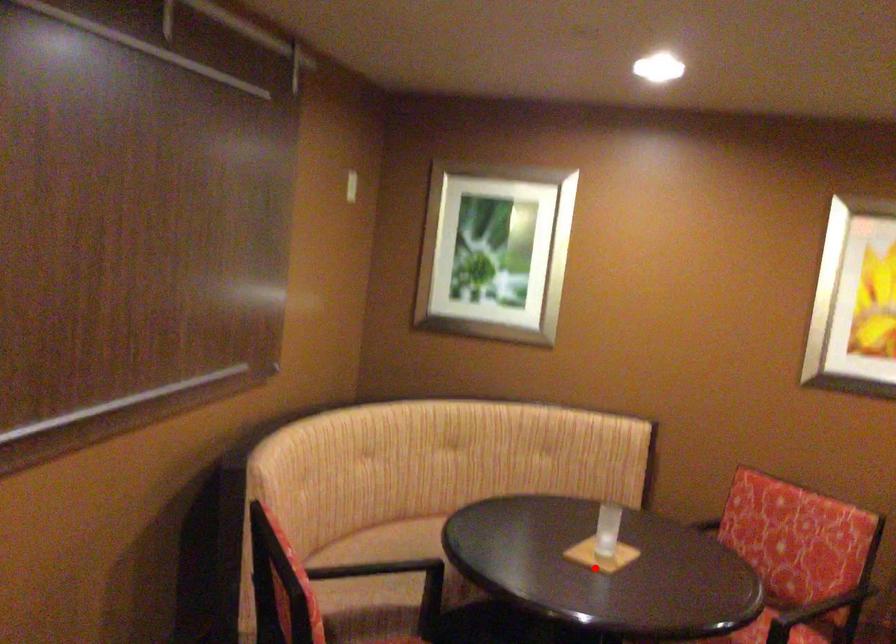
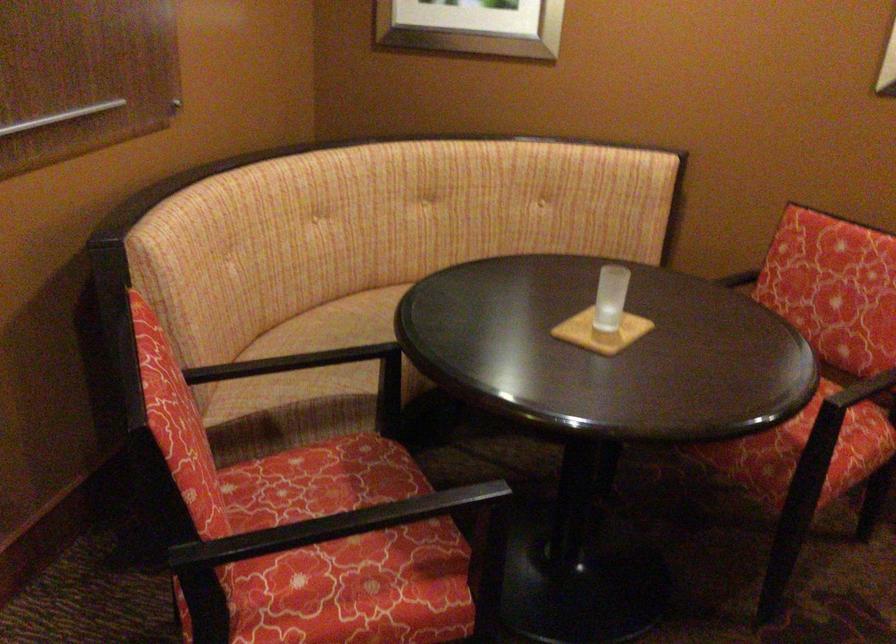
In the second image, find the point that corresponds to the highlighted location in the first image.

(600, 332)